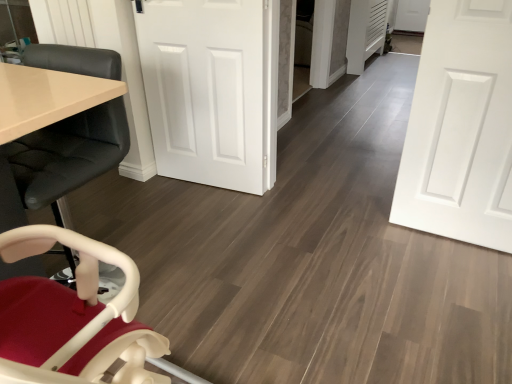
Question: Does point (167, 61) appear closer or farther from the camera than point (96, 160)?

Choices:
 (A) farther
 (B) closer

Answer: (A)

Question: From a real-world perspective, is white smooth door at center, acting as the first door starting from the left, above or below matte black chair at left?

Choices:
 (A) above
 (B) below

Answer: (A)

Question: Estimate the real-world distances between objects in this image. Which object is farther from the matte black chair at left?

Choices:
 (A) white smooth door at center, marked as the 2th door in a right-to-left arrangement
 (B) white matte door at center, placed as the second door when sorted from left to right

Answer: (B)

Question: Which object is positioned closest to the white matte door at center, placed as the second door when sorted from left to right?

Choices:
 (A) matte black chair at left
 (B) white smooth door at center, acting as the first door starting from the left

Answer: (B)